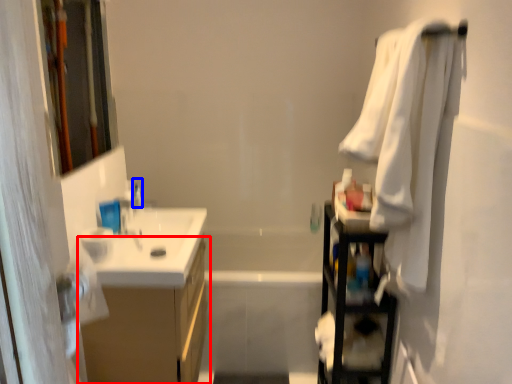
Question: Which object is closer to the camera taking this photo, bathroom cabinet (highlighted by a red box) or toiletry (highlighted by a blue box)?

Choices:
 (A) bathroom cabinet
 (B) toiletry

Answer: (A)